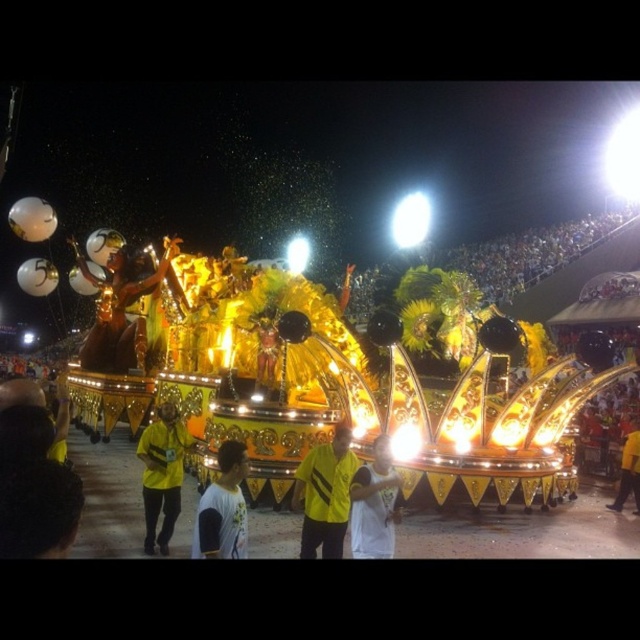
Who is positioned more to the right, gold metallic statue at center or white matte shirt at center?

white matte shirt at center is more to the right.

Describe the element at coordinates (120, 310) in the screenshot. The height and width of the screenshot is (640, 640). I see `gold metallic statue at center` at that location.

Between point (145, 339) and point (372, 541), which one is positioned behind?

Point (145, 339)

Find the location of a particular element. The image size is (640, 640). gold metallic statue at center is located at coordinates (120, 310).

Is gold metallic statue at center smaller than yellow matte shirt at center?

Actually, gold metallic statue at center might be larger than yellow matte shirt at center.

Find the location of a particular element. This screenshot has width=640, height=640. gold metallic statue at center is located at coordinates (120, 310).

Does yellow fabric shirt at center appear on the left side of white matte shirt at center?

Yes, yellow fabric shirt at center is to the left of white matte shirt at center.

Is yellow fabric shirt at center positioned in front of white matte shirt at center?

No, it is behind white matte shirt at center.

Where is `yellow fabric shirt at center`? yellow fabric shirt at center is located at coordinates (324, 493).